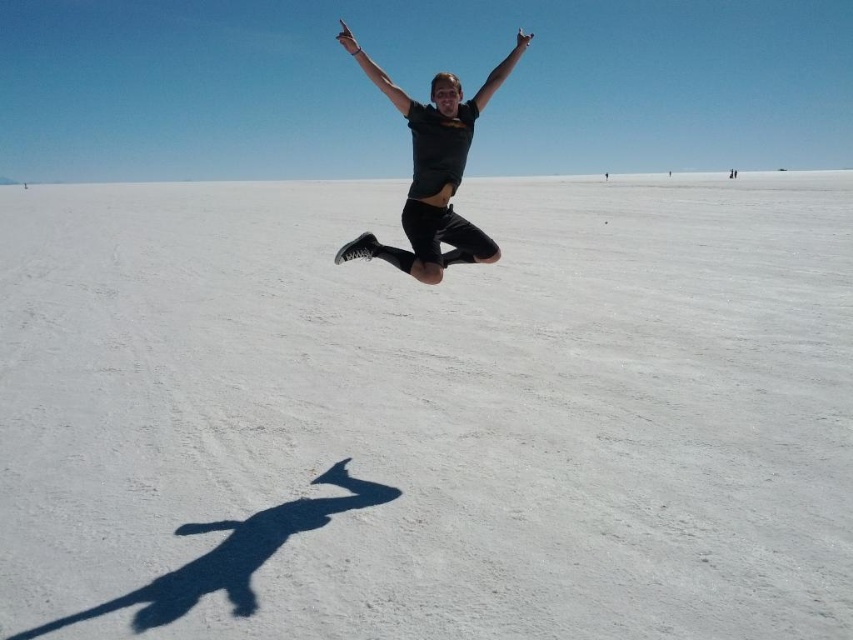
Question: Among these points, which one is nearest to the camera?

Choices:
 (A) (370, 248)
 (B) (115, 483)

Answer: (B)

Question: Which object is positioned farthest from the white matte snow at center?

Choices:
 (A) black matte shirt at center
 (B) matte black arm at upper center

Answer: (A)

Question: Is the position of white matte snow at center less distant than that of black matte shirt at center?

Choices:
 (A) yes
 (B) no

Answer: (A)

Question: Is black matte shirt at center wider than matte black arm at upper center?

Choices:
 (A) yes
 (B) no

Answer: (B)

Question: Which point is farther to the camera?

Choices:
 (A) (341, 259)
 (B) (589, 349)
 (C) (366, 65)

Answer: (B)

Question: Observing the image, what is the correct spatial positioning of white matte snow at center in reference to matte black arm at upper center?

Choices:
 (A) below
 (B) above

Answer: (A)